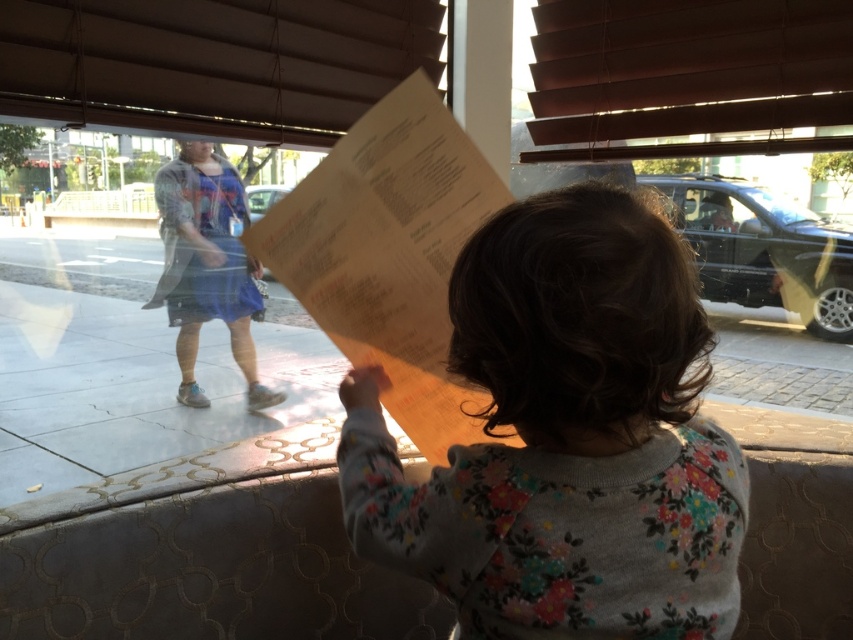
Does fluffy gray sweater at center appear under blue fabric dress at center?

Yes.

Locate an element on the screen. The image size is (853, 640). fluffy gray sweater at center is located at coordinates (566, 438).